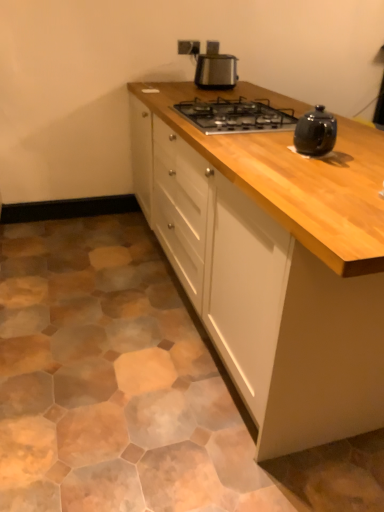
Question: From a real-world perspective, is black metal gas stove at center on white wood cabinet at center?

Choices:
 (A) yes
 (B) no

Answer: (A)

Question: Considering the relative sizes of black metal gas stove at center and white wood cabinet at center in the image provided, is black metal gas stove at center wider than white wood cabinet at center?

Choices:
 (A) yes
 (B) no

Answer: (B)

Question: Does black metal gas stove at center have a greater height compared to white wood cabinet at center?

Choices:
 (A) no
 (B) yes

Answer: (A)

Question: Is black metal gas stove at center outside white wood cabinet at center?

Choices:
 (A) no
 (B) yes

Answer: (A)

Question: Is black metal gas stove at center surrounding white wood cabinet at center?

Choices:
 (A) yes
 (B) no

Answer: (B)

Question: In the image, is satin metallic toaster at upper center positioned in front of or behind white wood cabinet at center?

Choices:
 (A) behind
 (B) front

Answer: (A)

Question: From a real-world perspective, is satin metallic toaster at upper center physically located above or below white wood cabinet at center?

Choices:
 (A) below
 (B) above

Answer: (B)

Question: Considering the positions of satin metallic toaster at upper center and white wood cabinet at center in the image, is satin metallic toaster at upper center bigger or smaller than white wood cabinet at center?

Choices:
 (A) small
 (B) big

Answer: (A)

Question: In terms of width, does satin metallic toaster at upper center look wider or thinner when compared to white wood cabinet at center?

Choices:
 (A) thin
 (B) wide

Answer: (A)

Question: In terms of size, does white wood cabinet at center appear bigger or smaller than satin metallic toaster at upper center?

Choices:
 (A) big
 (B) small

Answer: (A)

Question: Is white wood cabinet at center inside the boundaries of satin metallic toaster at upper center, or outside?

Choices:
 (A) outside
 (B) inside

Answer: (A)

Question: In terms of width, does white wood cabinet at center look wider or thinner when compared to satin metallic toaster at upper center?

Choices:
 (A) thin
 (B) wide

Answer: (B)

Question: From a real-world perspective, is white wood cabinet at center positioned above or below satin metallic toaster at upper center?

Choices:
 (A) below
 (B) above

Answer: (A)

Question: From a real-world perspective, is black metal gas stove at center positioned above or below satin metallic toaster at upper center?

Choices:
 (A) below
 (B) above

Answer: (A)

Question: Looking at the image, does black metal gas stove at center seem bigger or smaller compared to satin metallic toaster at upper center?

Choices:
 (A) big
 (B) small

Answer: (A)